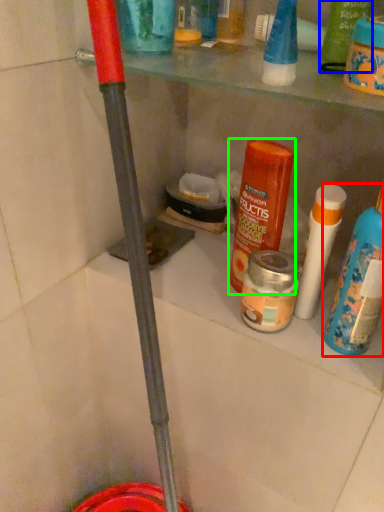
Question: Based on their relative distances, which object is farther from bottle (highlighted by a red box)? Choose from product (highlighted by a blue box) and product (highlighted by a green box).

Choices:
 (A) product
 (B) product

Answer: (A)